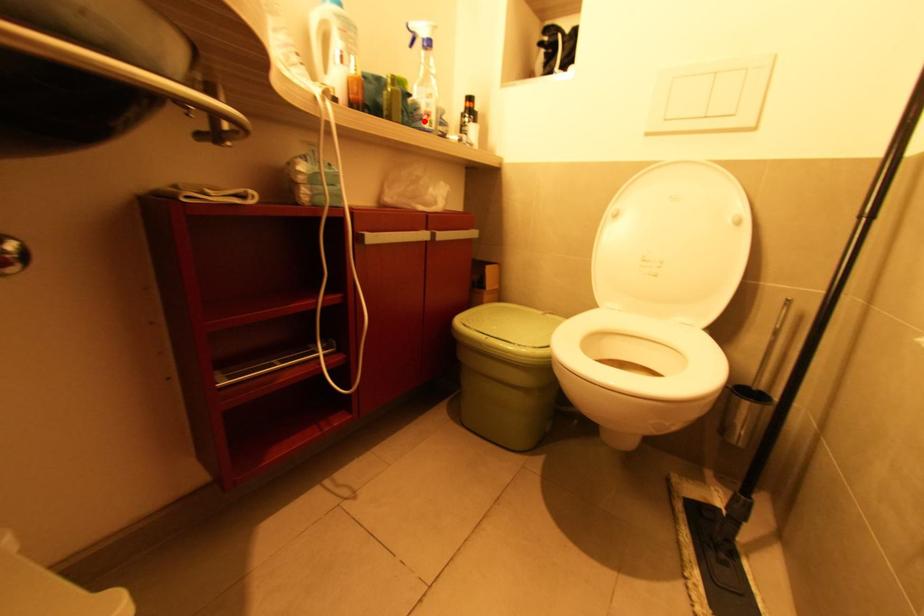
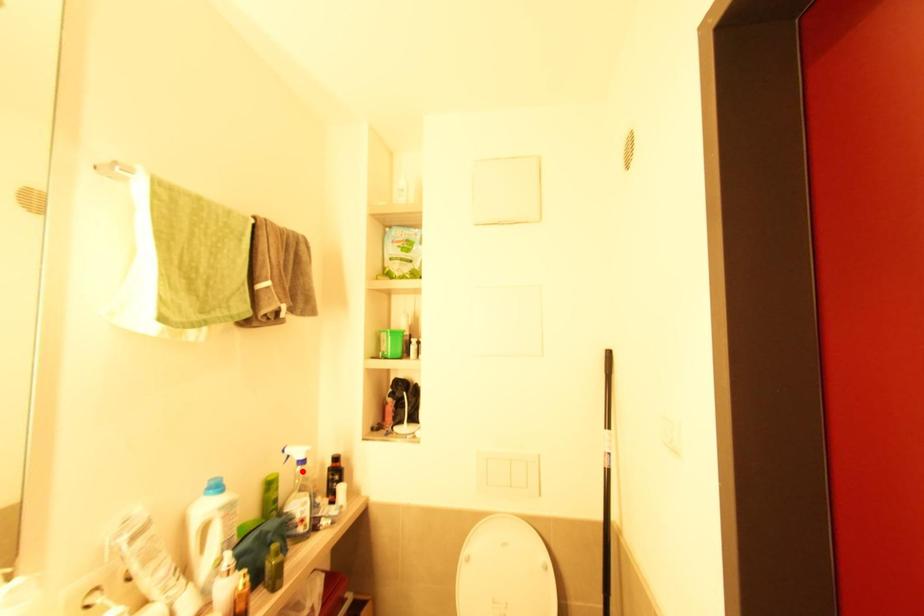
I am providing you with two images of the same scene from different viewpoints. A red point is marked on the first image and another point is marked on the second image. Is the marked point in image1 the same physical position as the marked point in image2?

No